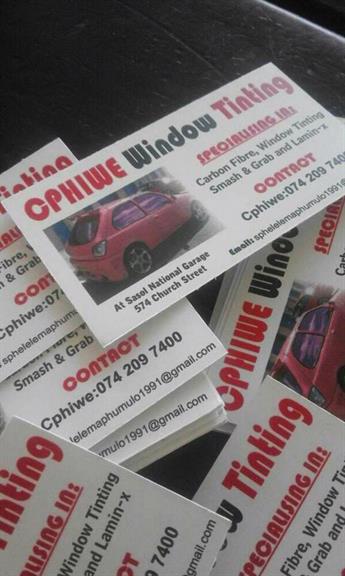
This screenshot has height=576, width=345. Identify the location of word "window". (73, 552), (319, 522), (274, 257), (279, 132).